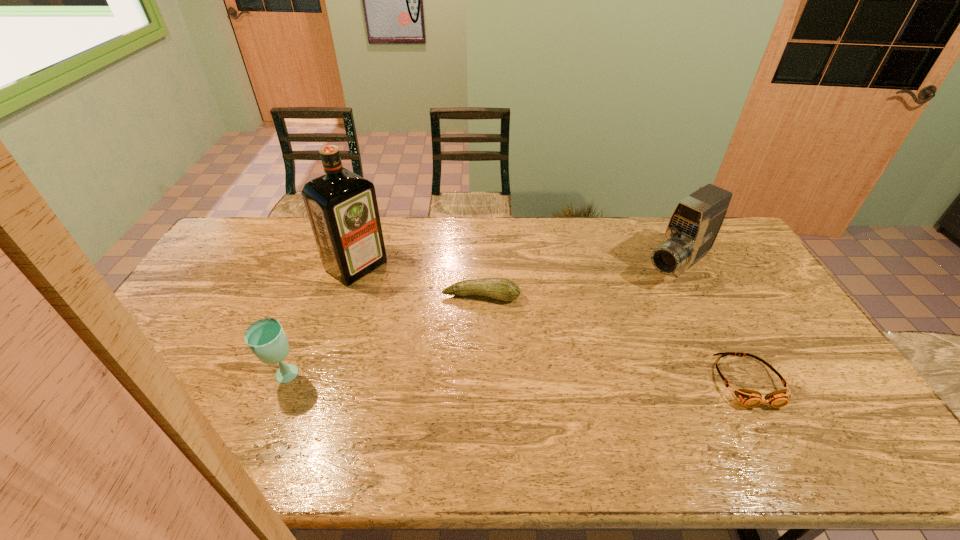
You are a GUI agent. You are given a task and a screenshot of the screen. Output one action in this format:
    pyautogui.click(x=<x>, y=<y>)
    Task: Click on the empty space that is in between the third tallest object and the third object from left to right
    Image resolution: width=960 pixels, height=540 pixels.
    Given the screenshot: What is the action you would take?
    pyautogui.click(x=382, y=337)

Locate an element on the screen. This screenshot has height=540, width=960. free space between the glass and the fourth shortest object is located at coordinates pyautogui.click(x=481, y=321).

This screenshot has height=540, width=960. I want to click on free space that is in between the camcorder and the goggles, so click(x=712, y=323).

The width and height of the screenshot is (960, 540). I want to click on free space between the goggles and the glass, so point(516,379).

The height and width of the screenshot is (540, 960). Find the location of `free point between the tallest object and the goggles`. free point between the tallest object and the goggles is located at coordinates (552, 323).

The width and height of the screenshot is (960, 540). In order to click on empty space that is in between the third tallest object and the fourth shortest object in this screenshot , I will do `click(481, 321)`.

In order to click on the fourth closest object to the third object from right to left in this screenshot , I will do `click(750, 398)`.

This screenshot has width=960, height=540. I want to click on object that is the third closest one to the second tallest object, so click(x=342, y=207).

In order to click on vacant region that satisfies the following two spatial constraints: 1. on the front side of the fourth tallest object; 2. on the right side of the liquor in this screenshot , I will do `click(347, 297)`.

Locate an element on the screen. This screenshot has width=960, height=540. free space that satisfies the following two spatial constraints: 1. on the back side of the third tallest object; 2. on the left side of the liquor is located at coordinates (327, 266).